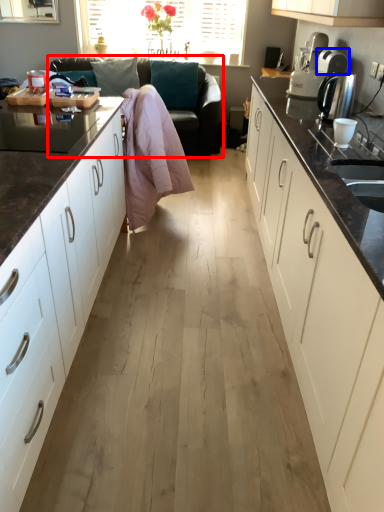
Question: Which of the following is the farthest to the observer, studio couch (highlighted by a red box) or appliance (highlighted by a blue box)?

Choices:
 (A) studio couch
 (B) appliance

Answer: (A)